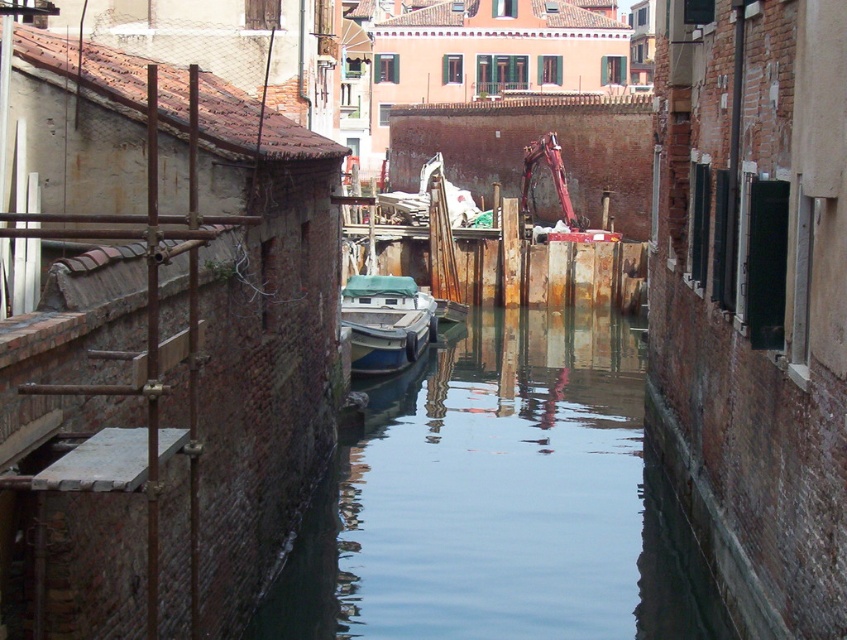
Which is below, brick wall at center or clear water at center?

clear water at center is below.

Who is taller, brick wall at center or clear water at center?

With more height is brick wall at center.

Which is behind, point (801, 260) or point (623, 529)?

Positioned behind is point (623, 529).

Where is `brick wall at center`? brick wall at center is located at coordinates (754, 300).

Who is shorter, brick wall at center or blue matte boat at center?

Standing shorter between the two is blue matte boat at center.

Is point (710, 490) positioned behind point (353, 305)?

No.

What do you see at coordinates (754, 300) in the screenshot? I see `brick wall at center` at bounding box center [754, 300].

Find the location of a particular element. brick wall at center is located at coordinates (754, 300).

Does clear water at center have a smaller size compared to blue matte boat at center?

No.

Can you confirm if clear water at center is shorter than blue matte boat at center?

Incorrect, clear water at center's height does not fall short of blue matte boat at center's.

Is point (654, 611) closer to camera compared to point (394, 330)?

Yes.

Locate an element on the screen. This screenshot has width=847, height=640. clear water at center is located at coordinates (499, 500).